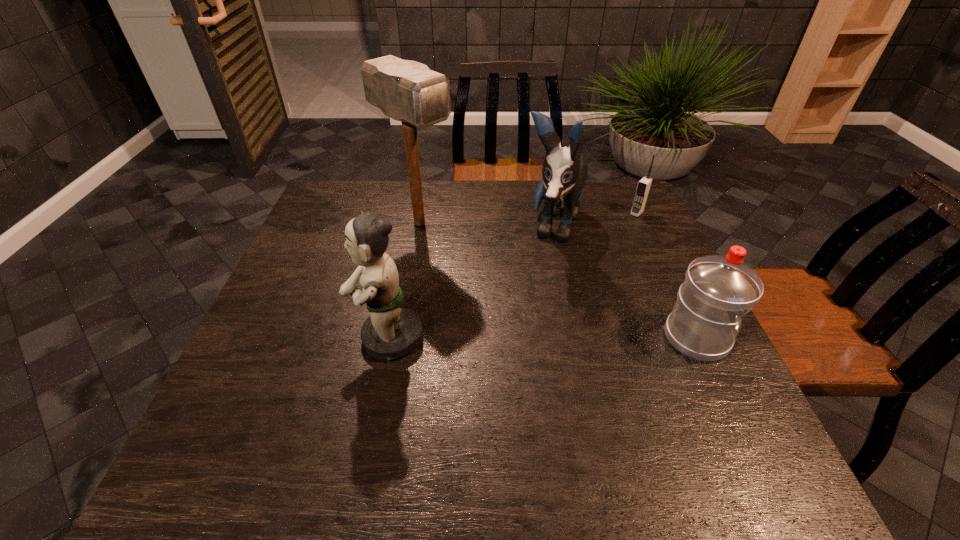
Where is `mallet that is at the far edge`? mallet that is at the far edge is located at coordinates (408, 91).

At what (x,y) coordinates should I click in order to perform the action: click on water bottle that is positioned at the right edge. Please return your answer as a coordinate pair (x, y). The width and height of the screenshot is (960, 540). Looking at the image, I should click on pos(718,290).

Where is `cellular telephone at the right edge`? This screenshot has width=960, height=540. cellular telephone at the right edge is located at coordinates (643, 188).

Where is `object present at the far right corner`? Image resolution: width=960 pixels, height=540 pixels. object present at the far right corner is located at coordinates (643, 188).

In the image, there is a desktop. Where is `vacant area at the far edge`? vacant area at the far edge is located at coordinates (468, 219).

In the image, there is a desktop. Where is `free space at the near edge`? This screenshot has width=960, height=540. free space at the near edge is located at coordinates (588, 410).

The width and height of the screenshot is (960, 540). In order to click on vacant space at the left edge in this screenshot , I will do `click(300, 289)`.

In the image, there is a desktop. What are the coordinates of `free space at the right edge` in the screenshot? It's located at (661, 329).

Find the location of a particular element. vacant region at the far right corner of the desktop is located at coordinates (616, 181).

At what (x,y) coordinates should I click in order to perform the action: click on free space at the near right corner. Please return your answer as a coordinate pair (x, y). The image size is (960, 540). Looking at the image, I should click on (687, 422).